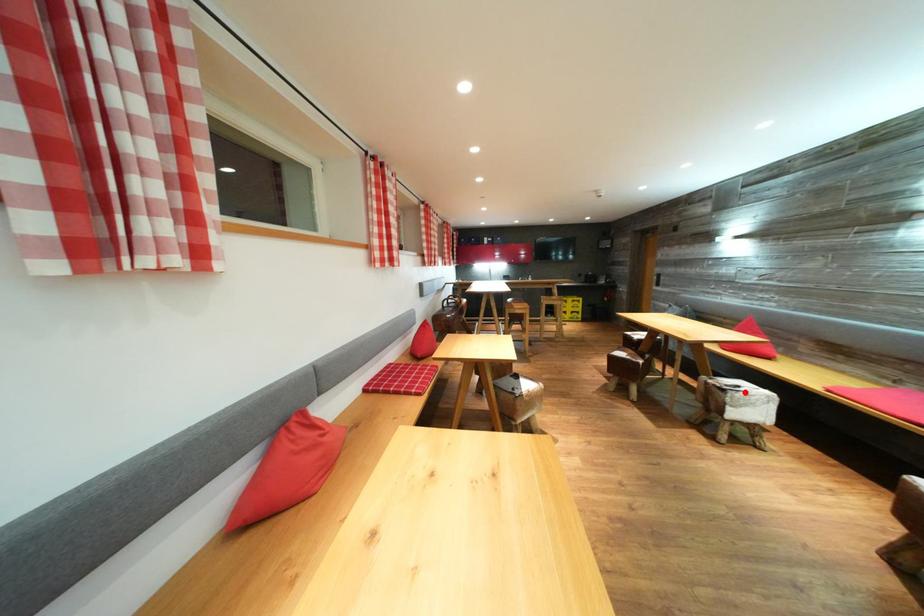
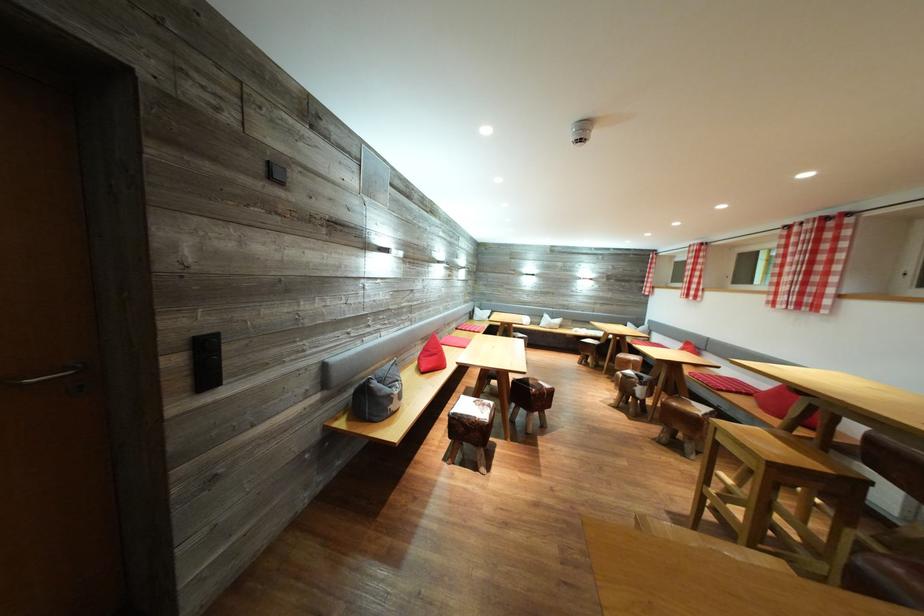
Question: I am providing you with two images of the same scene from different viewpoints. A red point is marked on the first image. Is the red point's position out of view in image 2?

Choices:
 (A) Yes
 (B) No

Answer: (A)